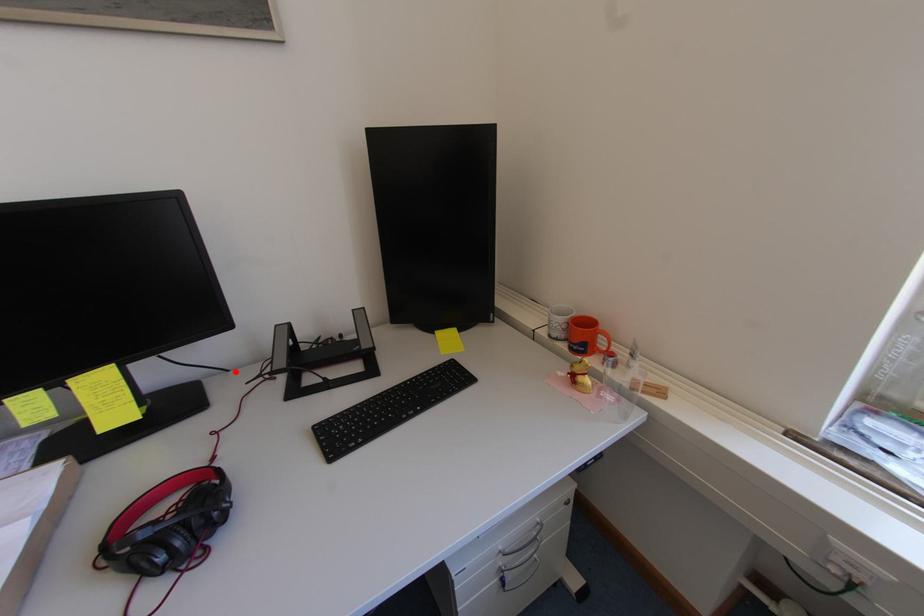
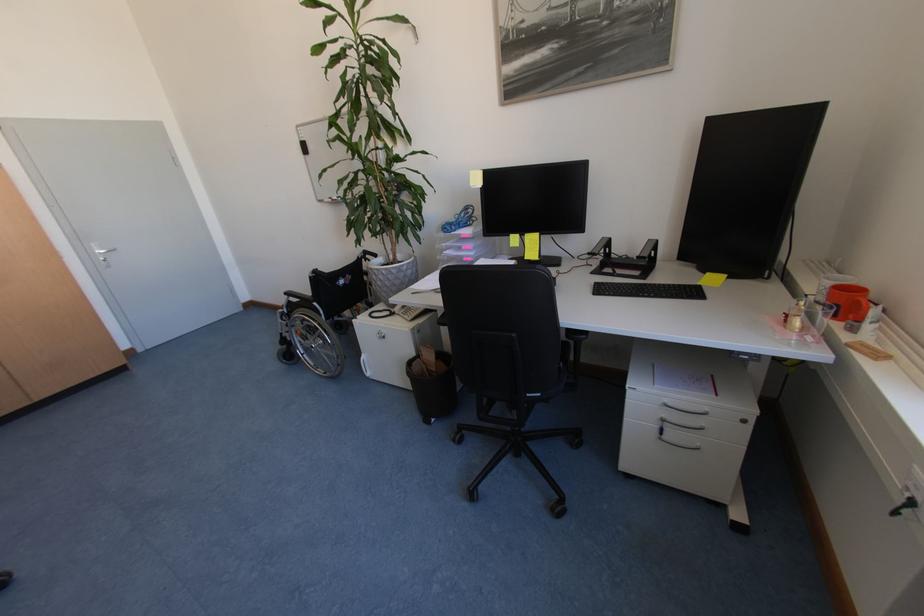
The point at the highlighted location is marked in the first image. Where is the corresponding point in the second image?

(581, 259)